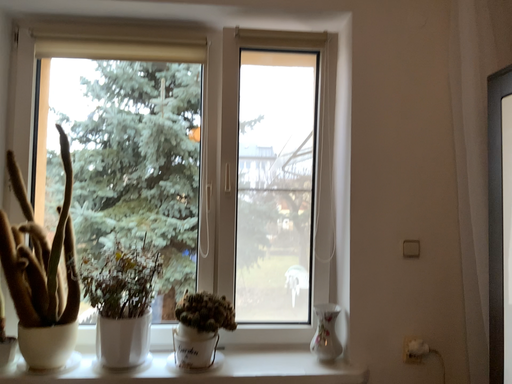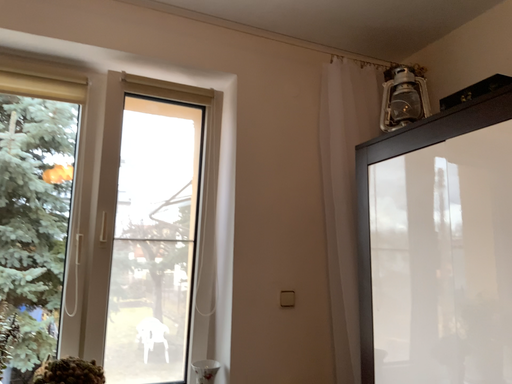
Question: Which way did the camera rotate in the video?

Choices:
 (A) rotated upward
 (B) rotated downward

Answer: (A)